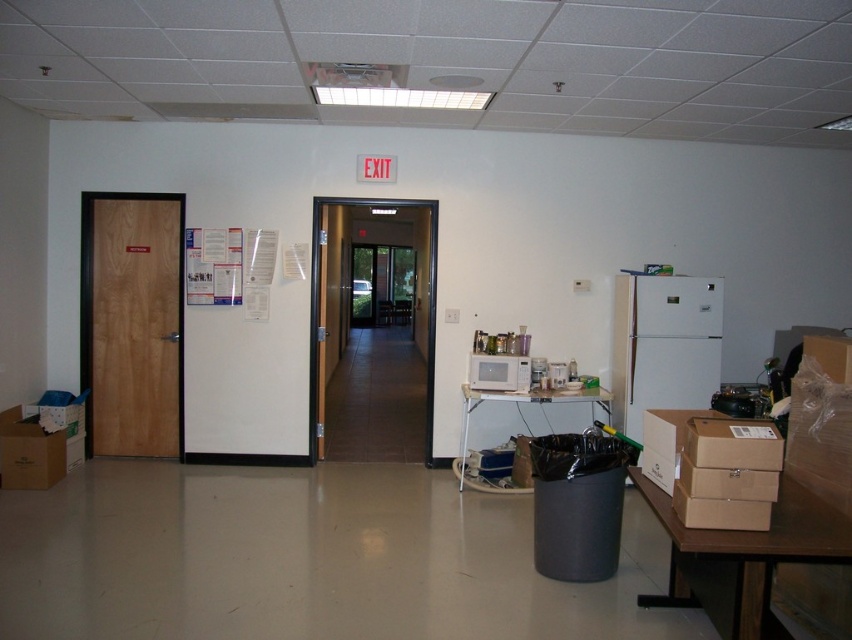
You are moving a 1.2 meter wide box through the hallway. The wooden door at left and the white paperboard bulletin board at upper left are in your path. Can you fit the box through the space between them without tilting it?

The wooden door at left is wider than the white paperboard bulletin board at upper left. Since the box is 1.2 meters wide, you need to check the narrower space between them. The bulletin board is narrower, so if the space between the door and bulletin board is at least 1.2 meters, it might fit. However, since the door is wider, the narrowest point might be the bulletin board side. Without exact measurements, it is uncertain, but since the door is wider, the space between them may be sufficient. However, the

You are a delivery person carrying a package that is 1.5 meters long. You need to move it through the hallway between the wooden door at left and the brown wooden door at center. Can the package fit through the space between them?

The distance between the wooden door at left and the brown wooden door at center is 1.43 meters. Since the package is 1.5 meters long, it is slightly longer than the available space. Therefore, the package cannot fit through the space between them.

You are standing at the center of the room. There is a wooden door at left and a point at coordinate (131, 323). Which is closer to you, the wooden door at left or the point?

The wooden door at left is located at point (131, 323), so they are at the same location.